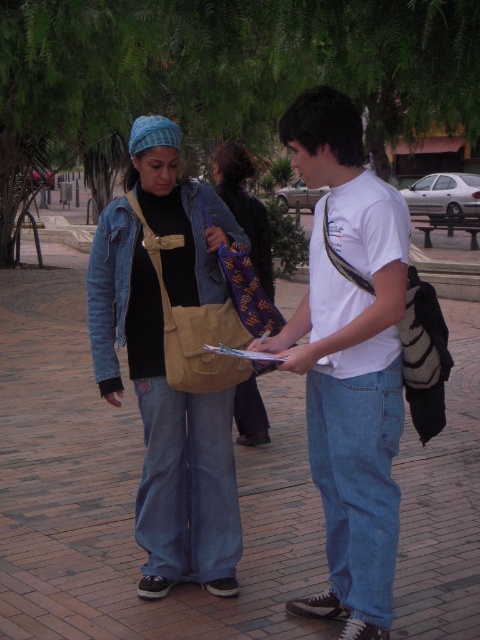
Can you confirm if matte beige bag at center is shorter than tan suede bag at center?

In fact, matte beige bag at center may be taller than tan suede bag at center.

Is matte beige bag at center positioned at the back of tan suede bag at center?

No.

Who is more forward, (222, 204) or (178, 344)?

Point (178, 344) is more forward.

Find the location of `matte beige bag at center`. matte beige bag at center is located at coordinates (164, 420).

Between point (475, 419) and point (362, 324), which one is positioned in front?

Point (362, 324)

Who is more forward, (38, 593) or (311, 184)?

Point (311, 184) is in front.

You are a GUI agent. You are given a task and a screenshot of the screen. Output one action in this format:
    pyautogui.click(x=<x>, y=<y>)
    Task: Click on the brick pavement at center
    
    Given the screenshot: What is the action you would take?
    pyautogui.click(x=127, y=490)

Who is more forward, (312,262) or (133,198)?

Point (312,262) is in front.

Which is behind, point (358, 195) or point (184, 317)?

Point (184, 317)

Which is behind, point (398, 212) or point (222, 387)?

Positioned behind is point (222, 387).

You are a GUI agent. You are given a task and a screenshot of the screen. Output one action in this format:
    pyautogui.click(x=<x>, y=<y>)
    Task: Click on the white matte t-shirt at center
    The width and height of the screenshot is (480, 640).
    Given the screenshot: What is the action you would take?
    pyautogui.click(x=348, y=360)